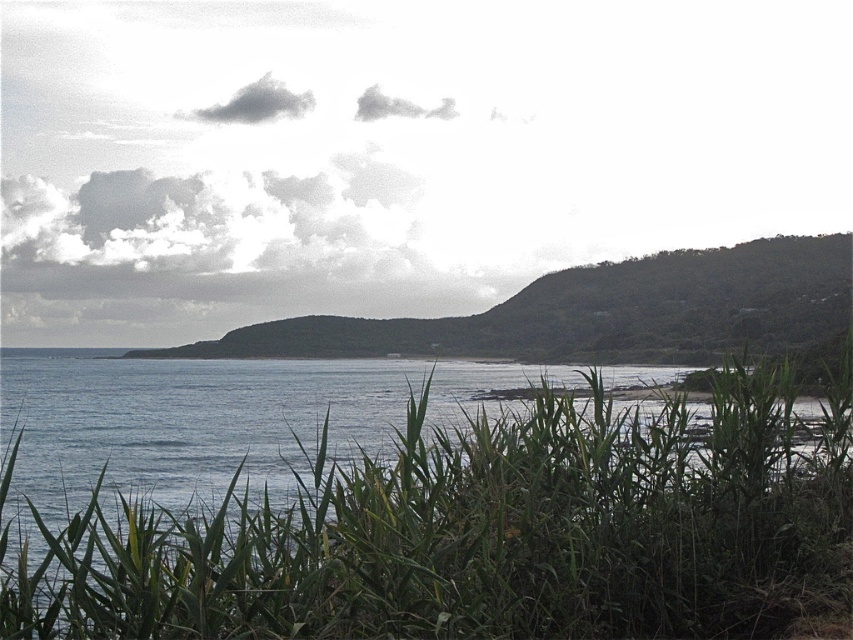
You are planning to set up a small tent for a coastal photography session. You have two options for locations based on the scene described. The first is near the green leafy grass at lower center, and the second is near the green textured hill at center. Considering the distance between them, which location would allow you to place the tent closer to the other landmark without overlapping?

The green leafy grass at lower center and green textured hill at center are 15.16 meters apart. To place the tent closer to both landmarks without overlapping, set it between them, approximately 7.58 meters from each.

You are a hiker who wants to cross the area between the green leafy grass at lower center and the green textured hill at center. Which path would be narrower?

The green leafy grass at lower center is thinner than the green textured hill at center, so the path between them would be narrower near the green leafy grass at lower center.

You are a hiker trying to find the best path to the top of the green textured hill at center. You notice the green leafy grass at lower center in your way. Considering their sizes, which object should you avoid stepping on to preserve the environment?

The green leafy grass at lower center is smaller than the green textured hill at center. To preserve the environment, you should avoid stepping on the green leafy grass at lower center since it is more delicate and easily damaged due to its smaller size.